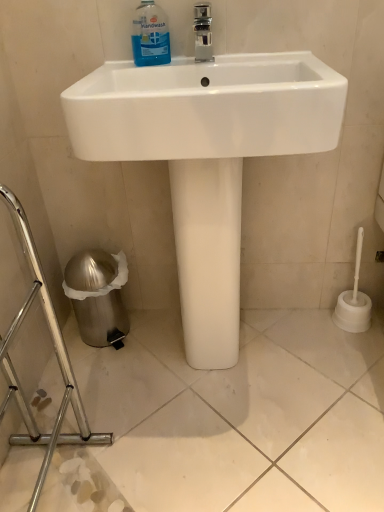
Question: Can you confirm if white glossy sink at center is taller than silver metallic trash can at lower left?

Choices:
 (A) no
 (B) yes

Answer: (B)

Question: Considering the relative positions of white glossy sink at center and silver metallic trash can at lower left in the image provided, is white glossy sink at center behind silver metallic trash can at lower left?

Choices:
 (A) yes
 (B) no

Answer: (A)

Question: Considering the relative sizes of white glossy sink at center and silver metallic trash can at lower left in the image provided, is white glossy sink at center smaller than silver metallic trash can at lower left?

Choices:
 (A) no
 (B) yes

Answer: (A)

Question: Does white glossy sink at center appear on the left side of silver metallic trash can at lower left?

Choices:
 (A) no
 (B) yes

Answer: (A)

Question: Is white glossy sink at center placed right next to silver metallic trash can at lower left?

Choices:
 (A) yes
 (B) no

Answer: (B)

Question: In terms of width, does blue translucent liquid at upper center look wider or thinner when compared to silver metallic trash can at lower left?

Choices:
 (A) wide
 (B) thin

Answer: (B)

Question: Is blue translucent liquid at upper center bigger or smaller than silver metallic trash can at lower left?

Choices:
 (A) big
 (B) small

Answer: (B)

Question: Is blue translucent liquid at upper center spatially inside silver metallic trash can at lower left, or outside of it?

Choices:
 (A) outside
 (B) inside

Answer: (A)

Question: In the image, is blue translucent liquid at upper center positioned in front of or behind silver metallic trash can at lower left?

Choices:
 (A) front
 (B) behind

Answer: (B)

Question: Would you say white glossy sink at center is to the left or to the right of blue translucent liquid at upper center in the picture?

Choices:
 (A) left
 (B) right

Answer: (B)

Question: Is point (302, 75) positioned closer to the camera than point (155, 13)?

Choices:
 (A) farther
 (B) closer

Answer: (B)

Question: Is white glossy sink at center in front of or behind blue translucent liquid at upper center in the image?

Choices:
 (A) front
 (B) behind

Answer: (A)

Question: Do you think white glossy sink at center is within blue translucent liquid at upper center, or outside of it?

Choices:
 (A) outside
 (B) inside

Answer: (A)

Question: Is silver metallic trash can at lower left wider or thinner than blue translucent liquid at upper center?

Choices:
 (A) thin
 (B) wide

Answer: (B)

Question: From the image's perspective, is silver metallic trash can at lower left positioned above or below blue translucent liquid at upper center?

Choices:
 (A) above
 (B) below

Answer: (B)